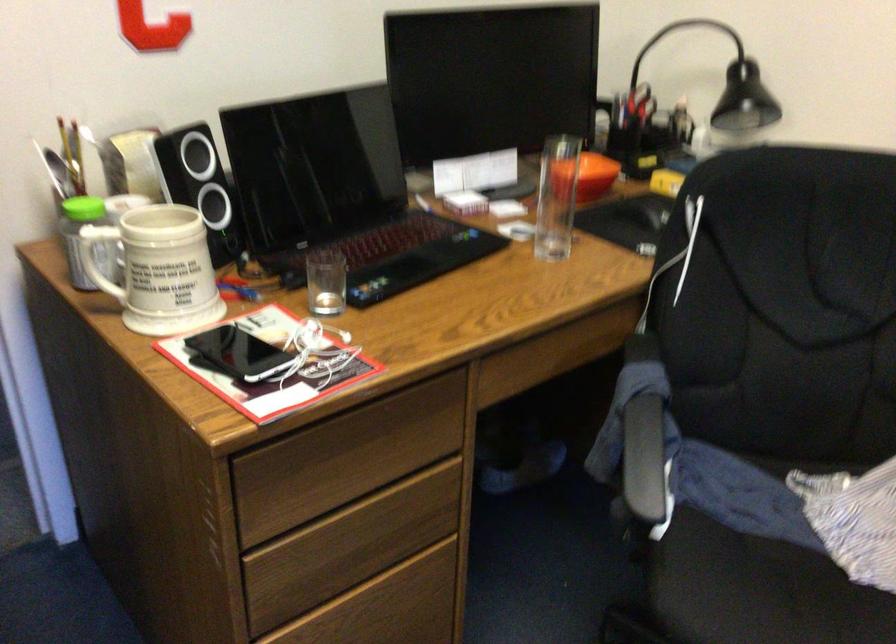
Where would you resting arm the chair armrest? Please return your answer as a coordinate pair (x, y).

(642, 442)